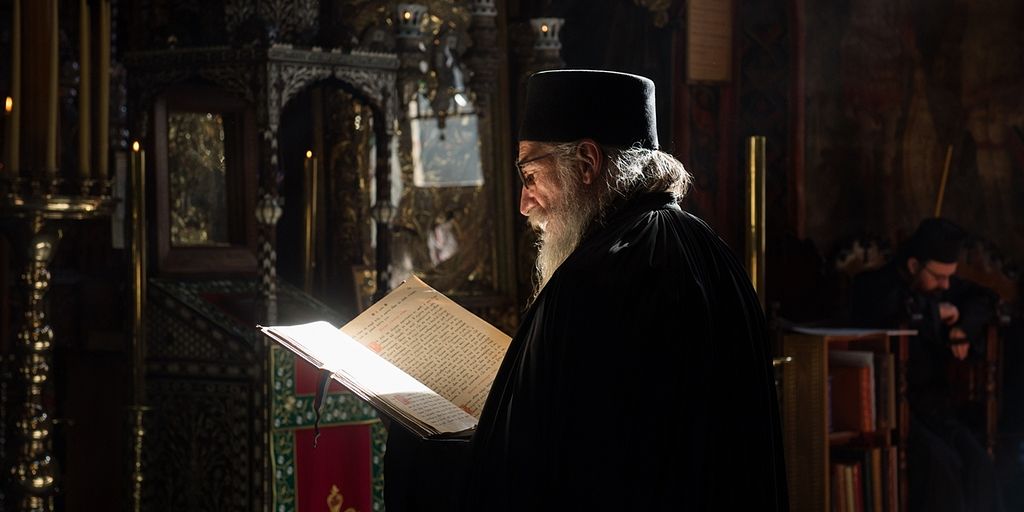
This screenshot has width=1024, height=512. Identify the location of shelf. (841, 354).